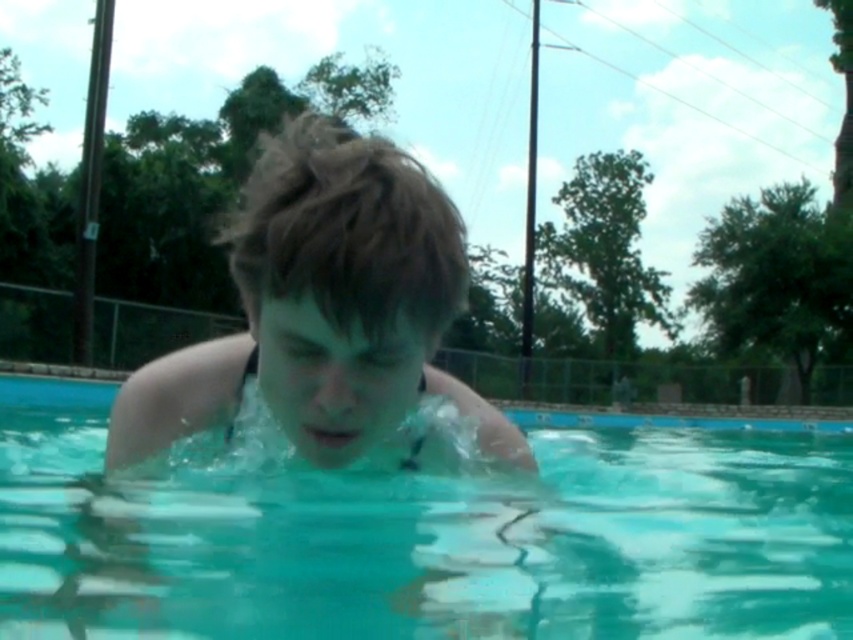
Question: From the image, what is the correct spatial relationship of clear blue water at center in relation to smooth skin boy at center?

Choices:
 (A) left
 (B) right

Answer: (A)

Question: Which object is farther from the camera taking this photo?

Choices:
 (A) clear blue water at center
 (B) smooth skin boy at center

Answer: (A)

Question: Does clear blue water at center come behind smooth skin boy at center?

Choices:
 (A) yes
 (B) no

Answer: (A)

Question: Is clear blue water at center bigger than smooth skin boy at center?

Choices:
 (A) yes
 (B) no

Answer: (A)

Question: Which object is closer to the camera taking this photo?

Choices:
 (A) smooth skin boy at center
 (B) clear blue water at center

Answer: (A)

Question: Which object is closer to the camera taking this photo?

Choices:
 (A) smooth skin boy at center
 (B) clear blue water at center

Answer: (A)